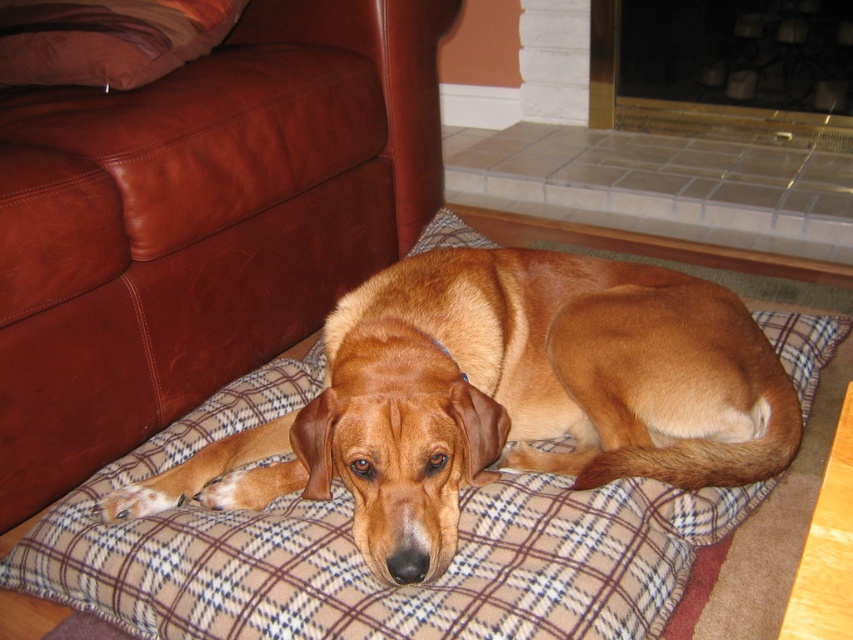
How distant is brown leather couch at left from brown leather pillow at upper left?

The distance of brown leather couch at left from brown leather pillow at upper left is 9.53 inches.

You are a GUI agent. You are given a task and a screenshot of the screen. Output one action in this format:
    pyautogui.click(x=<x>, y=<y>)
    Task: Click on the brown leather couch at left
    The image size is (853, 640).
    Given the screenshot: What is the action you would take?
    pyautogui.click(x=200, y=221)

Who is more forward, (320, 68) or (73, 26)?

Point (73, 26) is more forward.

In order to click on brown leather couch at left in this screenshot , I will do `click(200, 221)`.

Who is more distant from viewer, (108, 120) or (543, 401)?

The point (108, 120) is behind.

Which of these two, brown leather couch at left or shiny brown dog at center, stands shorter?

shiny brown dog at center is shorter.

Measure the distance between brown leather couch at left and camera.

A distance of 4.03 feet exists between brown leather couch at left and camera.

The height and width of the screenshot is (640, 853). Find the location of `brown leather couch at left`. brown leather couch at left is located at coordinates click(x=200, y=221).

Is shiny brown dog at center positioned in front of brown leather pillow at upper left?

That is True.

Identify the location of shiny brown dog at center. (503, 396).

The width and height of the screenshot is (853, 640). Identify the location of shiny brown dog at center. coord(503,396).